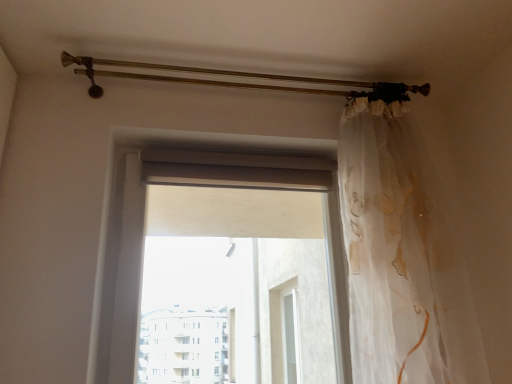
Question: Considering the relative sizes of translucent white curtain at right and translucent fabric at center in the image provided, is translucent white curtain at right thinner than translucent fabric at center?

Choices:
 (A) no
 (B) yes

Answer: (A)

Question: Is translucent white curtain at right located outside translucent fabric at center?

Choices:
 (A) no
 (B) yes

Answer: (B)

Question: Can you confirm if translucent white curtain at right is shorter than translucent fabric at center?

Choices:
 (A) no
 (B) yes

Answer: (A)

Question: Could translucent fabric at center be considered to be inside translucent white curtain at right?

Choices:
 (A) no
 (B) yes

Answer: (A)

Question: Is translucent white curtain at right wider than translucent fabric at center?

Choices:
 (A) yes
 (B) no

Answer: (A)

Question: Could you tell me if translucent white curtain at right is turned towards translucent fabric at center?

Choices:
 (A) no
 (B) yes

Answer: (A)

Question: Could you tell me if translucent fabric at center is facing translucent white curtain at right?

Choices:
 (A) yes
 (B) no

Answer: (A)

Question: Does translucent fabric at center have a greater height compared to translucent white curtain at right?

Choices:
 (A) no
 (B) yes

Answer: (A)

Question: Is translucent fabric at center at the left side of translucent white curtain at right?

Choices:
 (A) yes
 (B) no

Answer: (A)

Question: Does translucent fabric at center have a larger size compared to translucent white curtain at right?

Choices:
 (A) yes
 (B) no

Answer: (B)

Question: From the image's perspective, does translucent fabric at center appear higher than translucent white curtain at right?

Choices:
 (A) yes
 (B) no

Answer: (B)

Question: Is translucent fabric at center positioned with its back to translucent white curtain at right?

Choices:
 (A) no
 (B) yes

Answer: (A)

Question: Considering the positions of translucent fabric at center and translucent white curtain at right in the image, is translucent fabric at center taller or shorter than translucent white curtain at right?

Choices:
 (A) tall
 (B) short

Answer: (B)